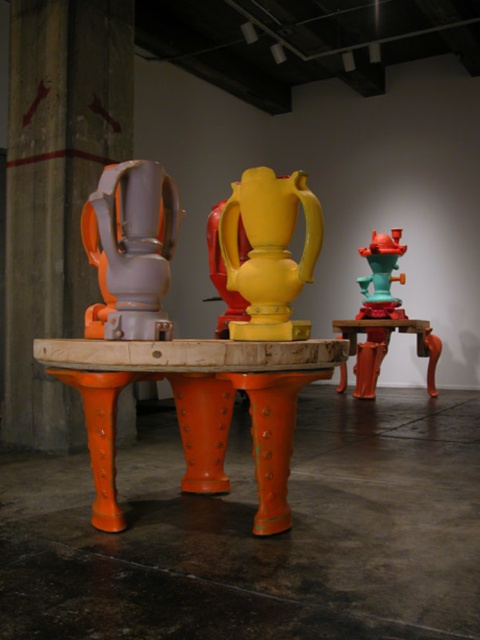
Question: Which object is the farthest from the matte gray vase at center?

Choices:
 (A) yellow matte vase at center
 (B) orange matte/finish pedestal at left
 (C) matte orange table at center
 (D) orange metallic table at center

Answer: (C)

Question: Does orange metallic table at center have a larger size compared to matte gray vase at center?

Choices:
 (A) no
 (B) yes

Answer: (B)

Question: Is orange matte/finish pedestal at left wider than yellow matte vase at center?

Choices:
 (A) no
 (B) yes

Answer: (B)

Question: Is matte gray vase at center positioned in front of teal glossy fire hydrant at center right?

Choices:
 (A) no
 (B) yes

Answer: (B)

Question: Which of the following is the farthest from the observer?

Choices:
 (A) matte gray vase at center
 (B) yellow matte vase at center
 (C) matte orange table at center
 (D) teal glossy fire hydrant at center right

Answer: (D)

Question: Based on their relative distances, which object is nearer to the yellow matte vase at center?

Choices:
 (A) teal glossy fire hydrant at center right
 (B) matte gray vase at center
 (C) orange matte/finish pedestal at left

Answer: (B)